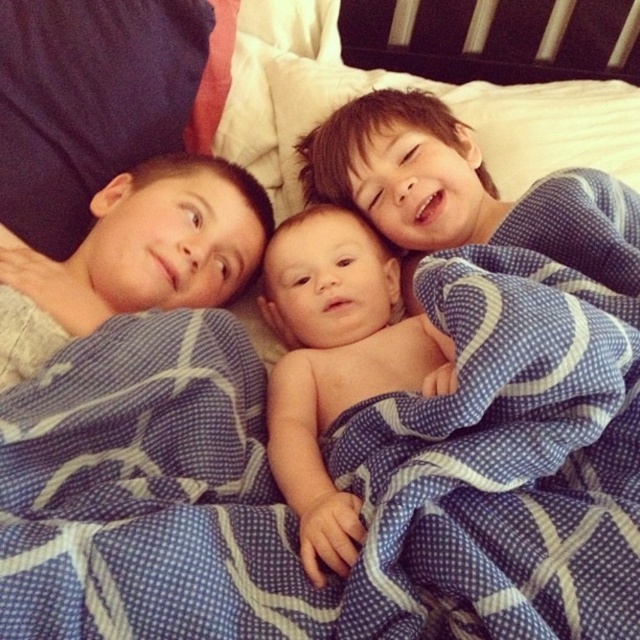
You are a photographer setting up a photo shoot for the three children on the bed. You need to ensure that the naked baby at center and the smooth skin baby at center are positioned so that they both fit comfortably within the frame. Given their sizes, which baby requires more space horizontally?

The smooth skin baby at center requires more space horizontally because it has a greater width than the naked baby at center.

You are a photographer trying to capture a closeup of the baby at the center. Which baby should you focus on to get a clearer image, the naked baby at center or the smooth skin baby at center?

The naked baby at center is closer to the viewer than the smooth skin baby at center, so focusing on the naked baby at center will result in a clearer image.